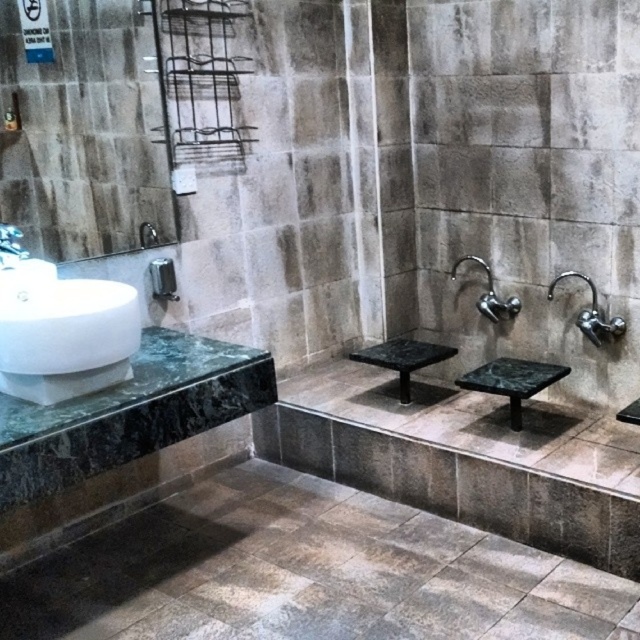
You are a plumber inspecting the bathroom fixtures. You notice two faucets in the bathroom. The satin nickel faucet at right and the white glossy faucet at upper left. Which faucet is taller?

The satin nickel faucet at right is taller than the white glossy faucet at upper left.

You are standing in the bathroom and want to know how far the point at coordinates (515, 403) is from your current position. Can you determine the distance?

The point at coordinates (515, 403) is 8.41 feet away from your current position.

You are a person of average height standing in the bathroom. You need to adjust the water temperature using the white glossy faucet at upper left. Can you comfortably reach it without standing on the green marble stool at center?

The green marble stool at center has a greater height compared to white glossy faucet at upper left. Since the faucet is lower than the stool, you can comfortably reach it without needing to stand on the stool.